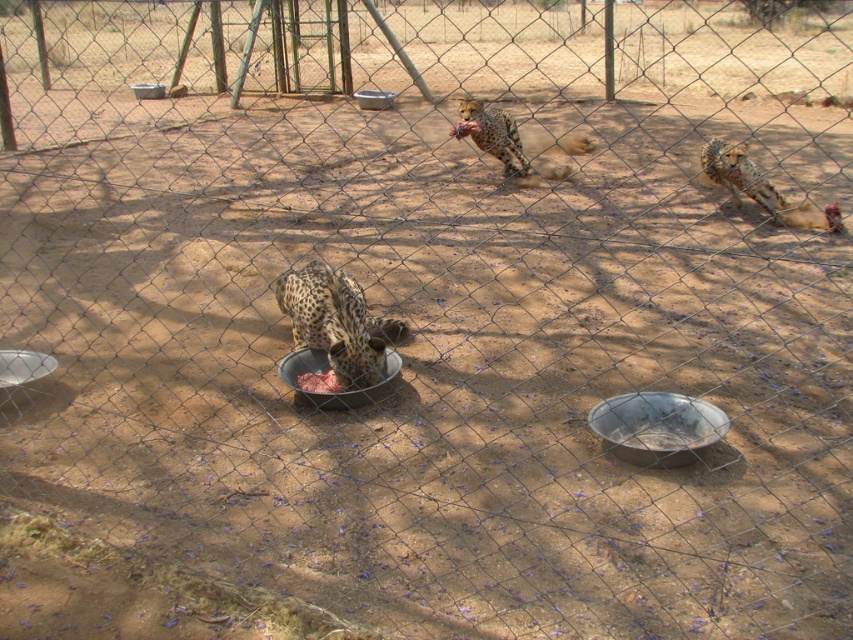
Question: Estimate the real-world distances between objects in this image. Which object is farther from the spotted fur cheetah at upper center?

Choices:
 (A) metallic gray bowl at center
 (B) spotted fur cheetah at lower center
 (C) metallic silver bowl at lower right
 (D) metallic silver bowl at center

Answer: (D)

Question: Can you confirm if metallic gray bowl at center is wider than pink meat at center?

Choices:
 (A) yes
 (B) no

Answer: (A)

Question: In this image, where is pink meat at center located relative to metallic silver bowl at center?

Choices:
 (A) above
 (B) below

Answer: (B)

Question: Which of the following is the closest to the observer?

Choices:
 (A) metallic gray bowl at center
 (B) spotted fur cheetah at lower center

Answer: (A)

Question: Considering the real-world distances, which object is farthest from the metallic silver bowl at center?

Choices:
 (A) spotted fur cheetah at upper center
 (B) metallic silver bowl at lower right
 (C) metallic gray bowl at center

Answer: (B)

Question: Is metallic silver bowl at lower right positioned in front of pink meat at center?

Choices:
 (A) yes
 (B) no

Answer: (A)